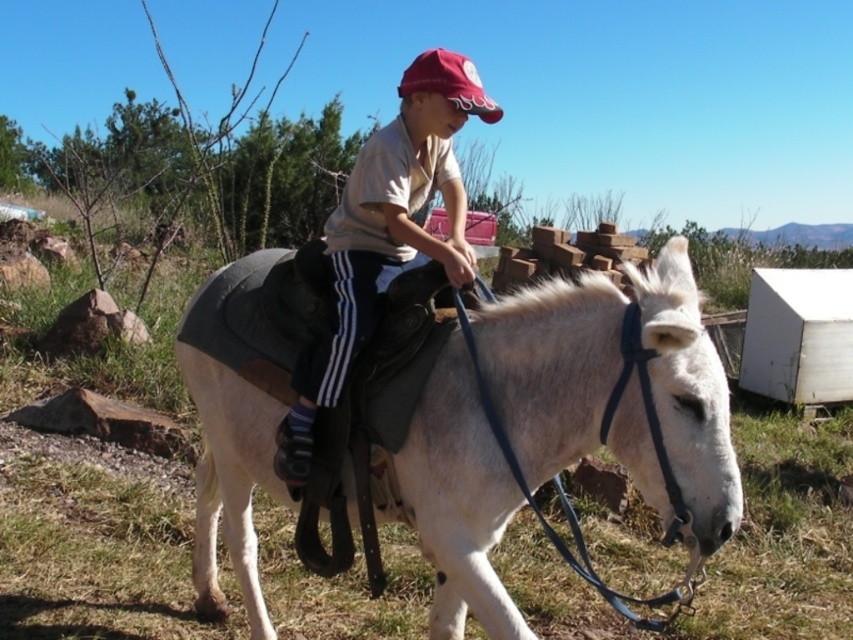
You are a photographer trying to capture a clear shot of both the white matte donkey at center and the matte khaki shirt at center. Since you want both subjects to be in focus, you need to know their relative positions. Based on the scene, which object is located to the right of the other?

The white matte donkey at center is positioned on the right side of matte khaki shirt at center, so the donkey is to the right of the shirt.

Looking at this image, you are a photographer trying to capture a photo of the donkey and rider. You notice two points marked in the image. The first point is at coordinates point (670, 387) and the second is at point (402, 90). Which point is closer to the camera?

Point (670, 387) is closer to the camera than point (402, 90).

You are standing in the field where the young person is riding the donkey. You notice two points marked in the scene. Which point is closer to you, point (448, 208) or point (432, 90)?

Point (448, 208) is further to the viewer than point (432, 90), so point (432, 90) is closer to you.